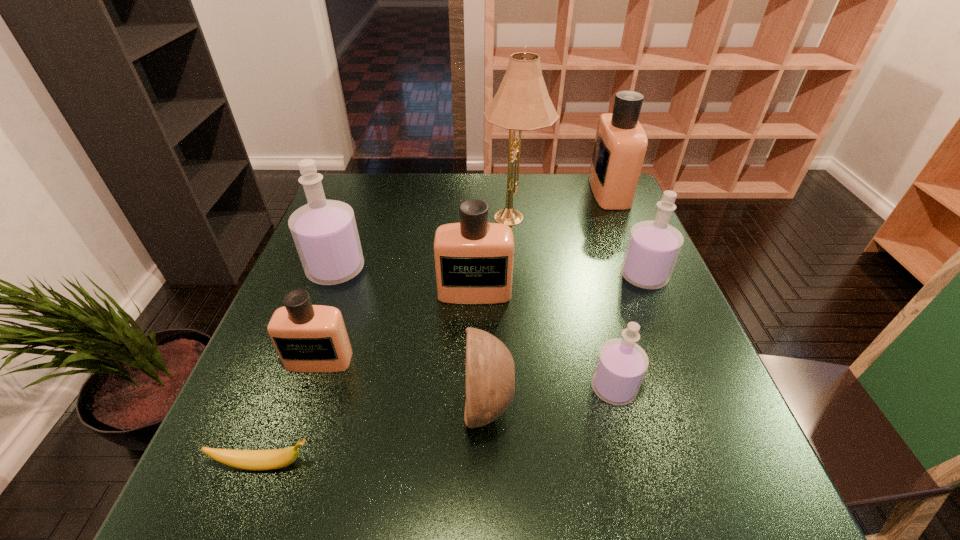
Find the location of a particular element. The height and width of the screenshot is (540, 960). free space located 0.060m on the left of the second biggest purple perfume is located at coordinates (596, 276).

Find the location of a particular element. This screenshot has height=540, width=960. free space located on the front label of the fourth perfume from right to left is located at coordinates (474, 324).

Where is `free spot located 0.190m on the back of the third object from right to left`? The image size is (960, 540). free spot located 0.190m on the back of the third object from right to left is located at coordinates (590, 302).

Identify the location of vacant region located 0.130m on the front label of the nearest beige perfume. (295, 434).

The height and width of the screenshot is (540, 960). In order to click on vacant space positioned on the back of the bowl in this screenshot , I will do `click(487, 318)`.

Find the location of `free space located at the stem of the yellow banana`. free space located at the stem of the yellow banana is located at coordinates (556, 464).

The height and width of the screenshot is (540, 960). Identify the location of lampshade present at the far edge. (522, 102).

Locate an element on the screen. The height and width of the screenshot is (540, 960). perfume that is at the far edge is located at coordinates (620, 146).

I want to click on object located at the near edge, so click(255, 460).

What are the coordinates of `banana located in the left edge section of the desktop` in the screenshot? It's located at (255, 460).